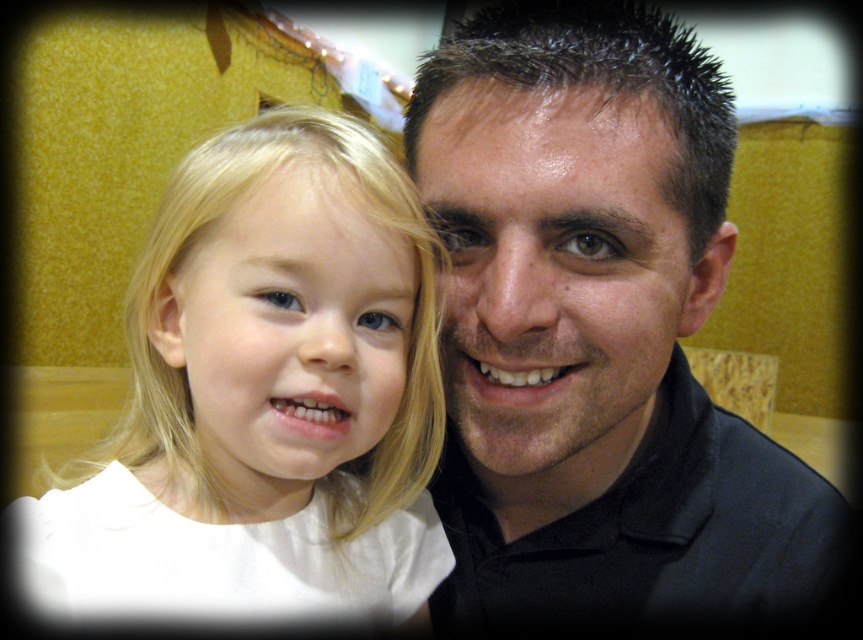
You are a photographer trying to adjust the lighting for a portrait. You notice the black matte shirt at center and the white matte hair at center. Which object should you focus on first if you want to ensure proper exposure, considering their sizes?

The black matte shirt at center is bigger than the white matte hair at center, so you should focus on the black matte shirt at center first to ensure proper exposure.

You are a photographer adjusting the focus of your camera. The camera has a focus point at coordinates point (555,273). Based on the scene, what part of the image is the focus point targeting?

The focus point at point (555,273) is targeting the smooth skin face at center.